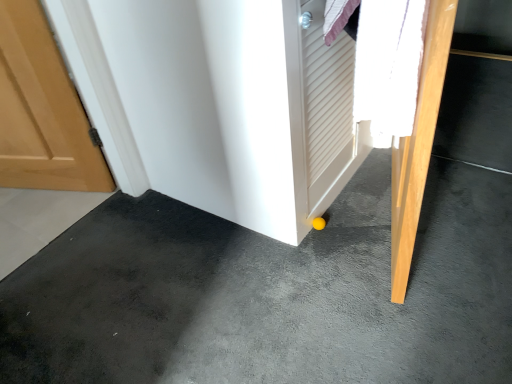
Question: Is point (236, 349) positioned closer to the camera than point (416, 180)?

Choices:
 (A) closer
 (B) farther

Answer: (B)

Question: Looking at the image, does yellow rubber ball at lower center seem bigger or smaller compared to light wood door at lower right?

Choices:
 (A) small
 (B) big

Answer: (B)

Question: Is yellow rubber ball at lower center taller or shorter than light wood door at lower right?

Choices:
 (A) tall
 (B) short

Answer: (B)

Question: Looking at their shapes, would you say light wood door at lower right is wider or thinner than yellow rubber ball at lower center?

Choices:
 (A) wide
 (B) thin

Answer: (B)

Question: Considering the positions of point (450, 39) and point (389, 233), is point (450, 39) closer or farther from the camera than point (389, 233)?

Choices:
 (A) farther
 (B) closer

Answer: (A)

Question: From the image's perspective, is light wood door at lower right above or below yellow rubber ball at lower center?

Choices:
 (A) below
 (B) above

Answer: (B)

Question: Is light wood door at lower right taller or shorter than yellow rubber ball at lower center?

Choices:
 (A) short
 (B) tall

Answer: (B)